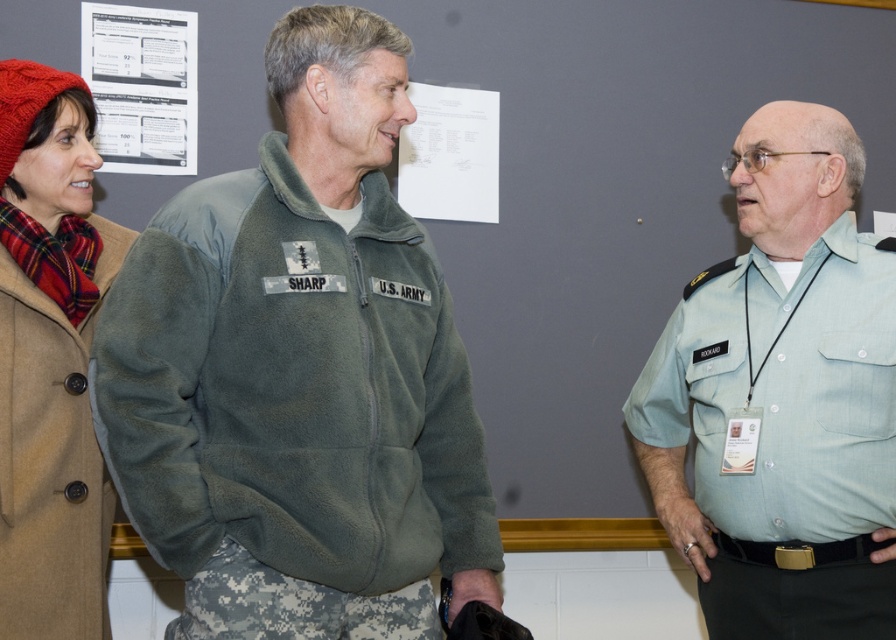
Who is more distant from viewer, (143,42) or (459,204)?

Positioned behind is point (459,204).

Is white paper at upper left taller than white paper at upper center?

Indeed, white paper at upper left has a greater height compared to white paper at upper center.

Who is more forward, (154, 17) or (487, 221)?

Positioned in front is point (154, 17).

This screenshot has width=896, height=640. I want to click on white paper at upper left, so click(141, 86).

Does light blue uniform at right appear on the left side of knitted wool hat at left?

In fact, light blue uniform at right is to the right of knitted wool hat at left.

Measure the distance between point (717,272) and camera.

They are 6.63 feet apart.

Locate an element on the screen. light blue uniform at right is located at coordinates (782, 397).

Which of these two, green fleece jacket at center or white paper at upper center, stands taller?

green fleece jacket at center

Is green fleece jacket at center positioned behind white paper at upper center?

No, green fleece jacket at center is in front of white paper at upper center.

Between point (311, 35) and point (452, 202), which one is positioned behind?

The point (452, 202) is behind.

This screenshot has height=640, width=896. In order to click on green fleece jacket at center in this screenshot , I will do `click(299, 372)`.